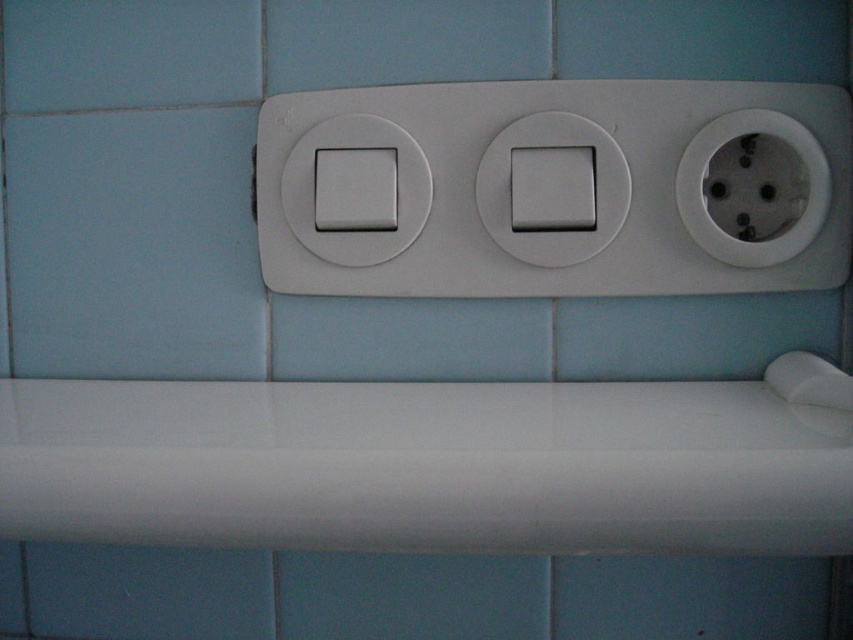
Question: Among these objects, which one is farthest from the camera?

Choices:
 (A) blue matte tile at lower center
 (B) white plastic light switch at center

Answer: (A)

Question: Estimate the real-world distances between objects in this image. Which object is farther from the white plastic light switch at center?

Choices:
 (A) white plastic socket at right
 (B) blue matte tile at lower center

Answer: (B)

Question: Among these objects, which one is nearest to the camera?

Choices:
 (A) blue matte tile at lower center
 (B) white plastic light switch at center
 (C) white plastic socket at right

Answer: (C)

Question: Does white plastic light switch at center have a greater width compared to blue matte tile at lower center?

Choices:
 (A) no
 (B) yes

Answer: (B)

Question: Does white plastic light switch at center appear under blue matte tile at lower center?

Choices:
 (A) no
 (B) yes

Answer: (A)

Question: Does white plastic light switch at center appear over blue matte tile at lower center?

Choices:
 (A) yes
 (B) no

Answer: (A)